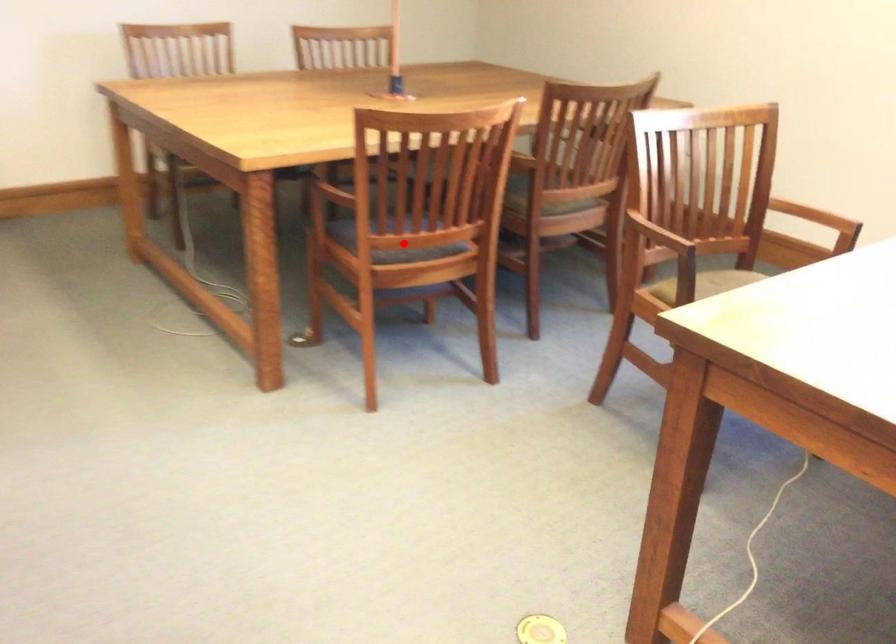
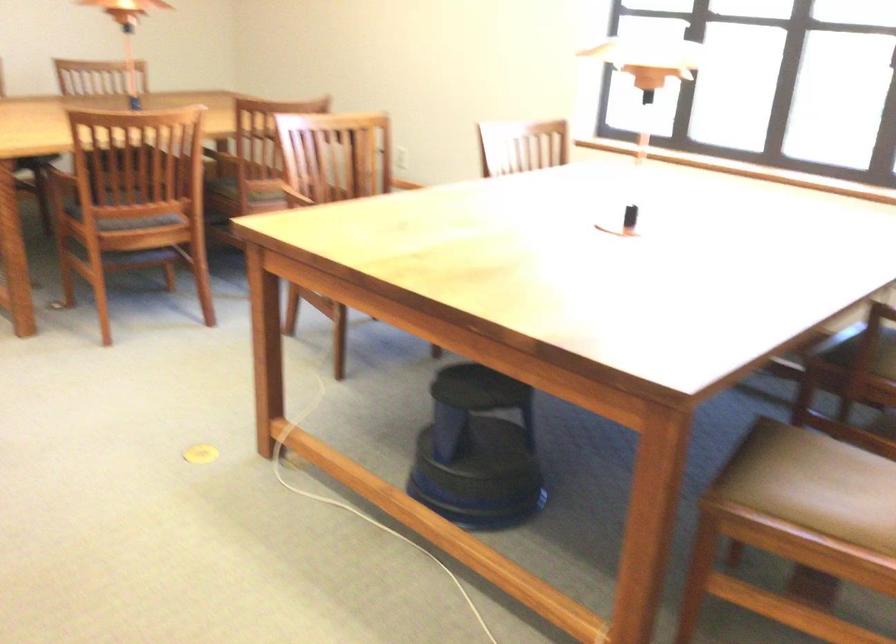
The point at the highlighted location is marked in the first image. Where is the corresponding point in the second image?

(128, 209)